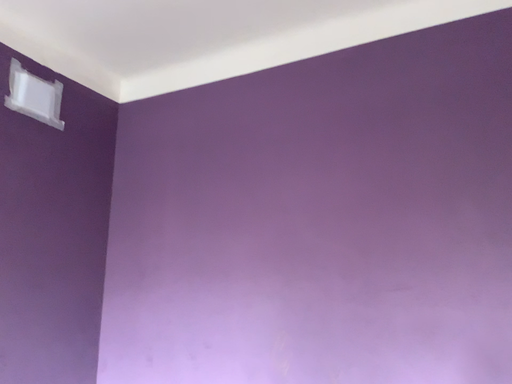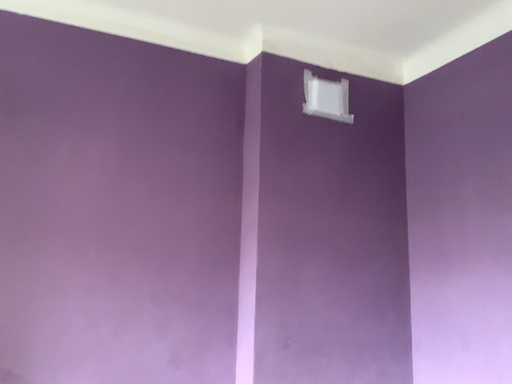
Question: How did the camera likely rotate when shooting the video?

Choices:
 (A) rotated right
 (B) rotated left

Answer: (B)